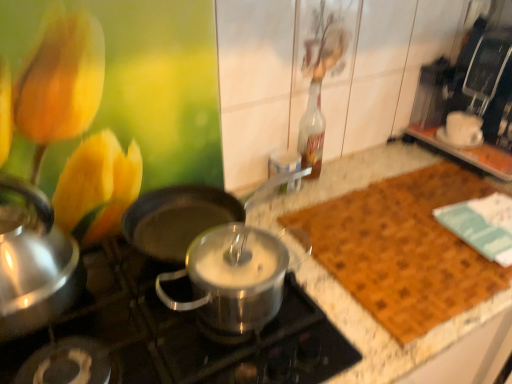
Question: Is stainless steel pot at center turned away from brown woven mat at right?

Choices:
 (A) yes
 (B) no

Answer: (B)

Question: Is stainless steel pot at center far away from brown woven mat at right?

Choices:
 (A) no
 (B) yes

Answer: (A)

Question: Is stainless steel pot at center bigger than brown woven mat at right?

Choices:
 (A) no
 (B) yes

Answer: (B)

Question: Does stainless steel pot at center touch brown woven mat at right?

Choices:
 (A) no
 (B) yes

Answer: (A)

Question: Considering the relative sizes of stainless steel pot at center and brown woven mat at right in the image provided, is stainless steel pot at center shorter than brown woven mat at right?

Choices:
 (A) no
 (B) yes

Answer: (A)

Question: Is black matte wok at center spatially inside white ceramic cup at upper right, or outside of it?

Choices:
 (A) inside
 (B) outside

Answer: (B)

Question: Does point (180, 228) appear closer or farther from the camera than point (470, 144)?

Choices:
 (A) closer
 (B) farther

Answer: (A)

Question: From the image's perspective, is black matte wok at center above or below white ceramic cup at upper right?

Choices:
 (A) below
 (B) above

Answer: (A)

Question: Is black matte wok at center taller or shorter than white ceramic cup at upper right?

Choices:
 (A) tall
 (B) short

Answer: (A)

Question: Is white ceramic cup at upper right inside or outside of brushed metal kettle at left?

Choices:
 (A) inside
 (B) outside

Answer: (B)

Question: From a real-world perspective, relative to brushed metal kettle at left, is white ceramic cup at upper right vertically above or below?

Choices:
 (A) below
 (B) above

Answer: (A)

Question: Considering the positions of white ceramic cup at upper right and brushed metal kettle at left in the image, is white ceramic cup at upper right wider or thinner than brushed metal kettle at left?

Choices:
 (A) wide
 (B) thin

Answer: (B)

Question: Is white ceramic cup at upper right taller or shorter than brushed metal kettle at left?

Choices:
 (A) short
 (B) tall

Answer: (A)

Question: Is black matte wok at center spatially inside brown woven mat at right, or outside of it?

Choices:
 (A) outside
 (B) inside

Answer: (A)

Question: Based on their sizes in the image, would you say black matte wok at center is bigger or smaller than brown woven mat at right?

Choices:
 (A) small
 (B) big

Answer: (B)